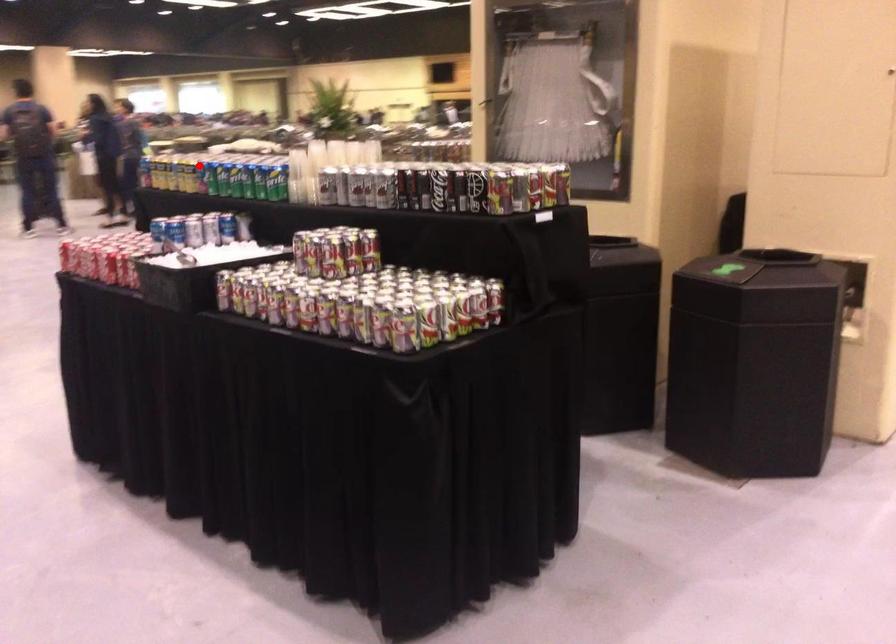
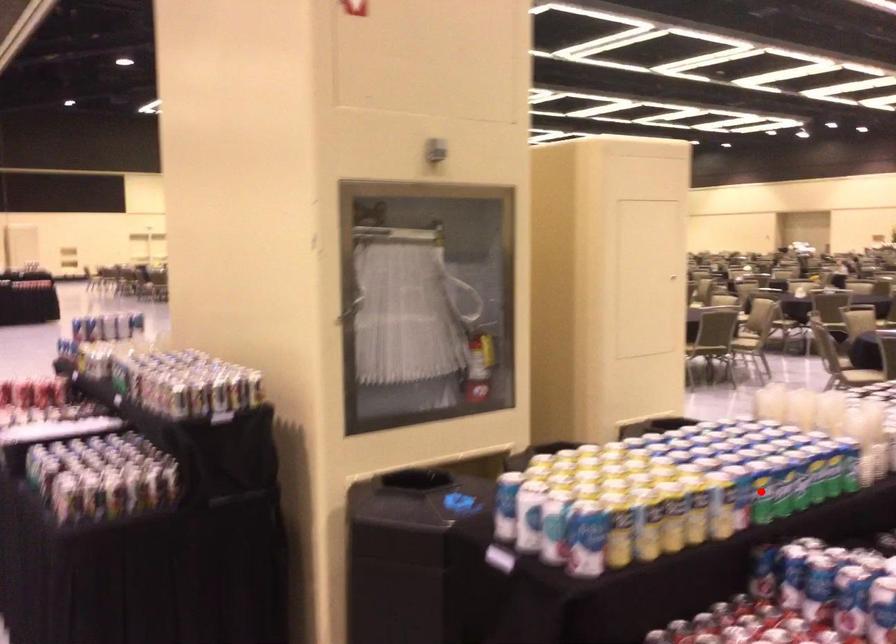
I am providing you with two images of the same scene from different viewpoints. A red point is marked on the first image and another point is marked on the second image. Do the highlighted points in image1 and image2 indicate the same real-world spot?

Yes